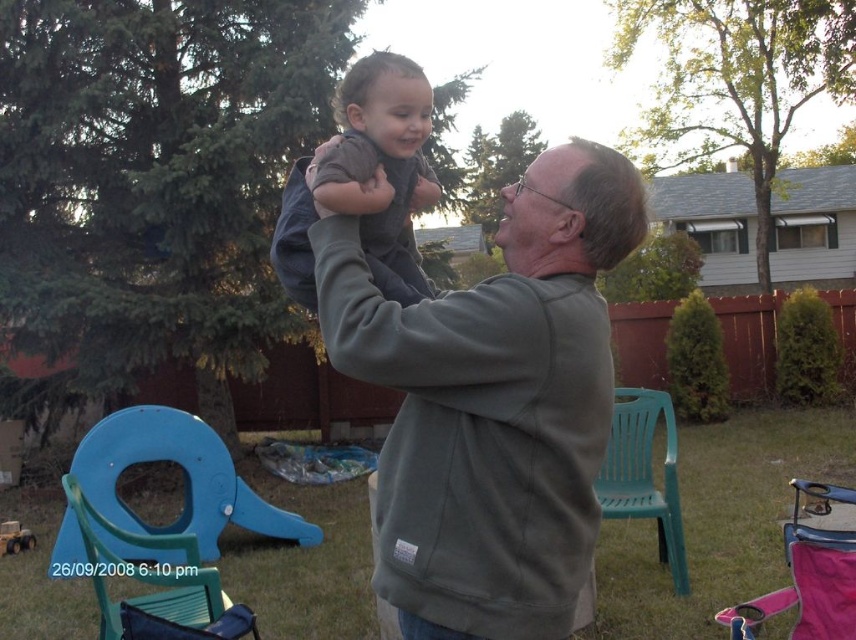
Does matte gray hoodie at center appear on the right side of blue plastic chair at lower left?

Correct, you'll find matte gray hoodie at center to the right of blue plastic chair at lower left.

Between matte gray hoodie at center and blue plastic chair at lower left, which one appears on the left side from the viewer's perspective?

blue plastic chair at lower left

Image resolution: width=856 pixels, height=640 pixels. I want to click on matte gray hoodie at center, so click(366, 179).

Where is `olive green sweatshirt at center`? Image resolution: width=856 pixels, height=640 pixels. olive green sweatshirt at center is located at coordinates tap(492, 403).

The height and width of the screenshot is (640, 856). Describe the element at coordinates (492, 403) in the screenshot. I see `olive green sweatshirt at center` at that location.

Locate an element on the screen. This screenshot has height=640, width=856. olive green sweatshirt at center is located at coordinates (492, 403).

Between pink fabric chair at lower right and green plastic chair at right, which one has less height?

pink fabric chair at lower right

Does pink fabric chair at lower right have a larger size compared to green plastic chair at right?

Yes.

Which is in front, point (829, 548) or point (658, 524)?

Point (829, 548) is in front.

The height and width of the screenshot is (640, 856). What are the coordinates of `pink fabric chair at lower right` in the screenshot? It's located at (807, 576).